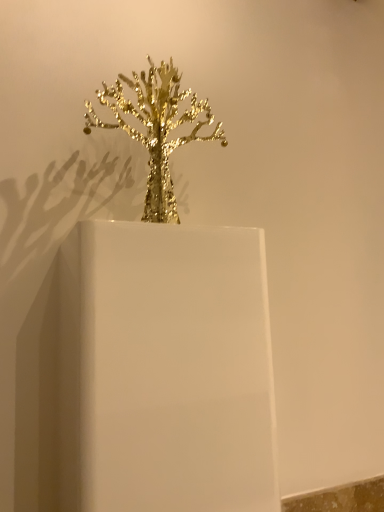
This screenshot has width=384, height=512. Describe the element at coordinates (155, 129) in the screenshot. I see `gold metallic tree at center` at that location.

Measure the distance between point (93, 126) and camera.

Point (93, 126) and camera are 1.11 meters apart.

Where is `gold metallic tree at center`? This screenshot has width=384, height=512. gold metallic tree at center is located at coordinates (155, 129).

The height and width of the screenshot is (512, 384). Describe the element at coordinates (165, 370) in the screenshot. I see `white glossy candle holder at center` at that location.

Locate an element on the screen. This screenshot has width=384, height=512. white glossy candle holder at center is located at coordinates (165, 370).

Where is `gold metallic tree at center`? Image resolution: width=384 pixels, height=512 pixels. gold metallic tree at center is located at coordinates (155, 129).

Which is more to the right, gold metallic tree at center or white glossy candle holder at center?

From the viewer's perspective, gold metallic tree at center appears more on the right side.

Is gold metallic tree at center closer to camera compared to white glossy candle holder at center?

No, gold metallic tree at center is further to the viewer.

Is point (168, 112) behind point (131, 368)?

Yes, it is behind point (131, 368).

From the image's perspective, is gold metallic tree at center under white glossy candle holder at center?

No.

From a real-world perspective, is gold metallic tree at center physically located above or below white glossy candle holder at center?

Clearly, from a real-world perspective, gold metallic tree at center is above white glossy candle holder at center.

Which of these two, gold metallic tree at center or white glossy candle holder at center, is wider?

white glossy candle holder at center.

Is gold metallic tree at center shorter than white glossy candle holder at center?

Yes, gold metallic tree at center is shorter than white glossy candle holder at center.

Is gold metallic tree at center bigger or smaller than white glossy candle holder at center?

gold metallic tree at center is smaller than white glossy candle holder at center.

Is white glossy candle holder at center inside gold metallic tree at center?

Actually, white glossy candle holder at center is outside gold metallic tree at center.

Is the surface of gold metallic tree at center in direct contact with white glossy candle holder at center?

No, gold metallic tree at center is not in contact with white glossy candle holder at center.

Is white glossy candle holder at center at the back of gold metallic tree at center?

No, gold metallic tree at center is not facing the opposite direction of white glossy candle holder at center.

How far apart are gold metallic tree at center and white glossy candle holder at center?

gold metallic tree at center is 13.17 inches away from white glossy candle holder at center.

I want to click on houseplant that is above the white glossy candle holder at center (from a real-world perspective), so click(155, 129).

Can you confirm if white glossy candle holder at center is positioned to the right of gold metallic tree at center?

No.

Is white glossy candle holder at center positioned behind gold metallic tree at center?

No, the depth of white glossy candle holder at center is less than that of gold metallic tree at center.

Is point (60, 484) behind point (122, 98)?

That is False.

From the image's perspective, which is above, white glossy candle holder at center or gold metallic tree at center?

From the image's view, gold metallic tree at center is above.

From a real-world perspective, which object rests below the other?

From a 3D spatial view, white glossy candle holder at center is below.

Can you confirm if white glossy candle holder at center is wider than gold metallic tree at center?

Indeed, white glossy candle holder at center has a greater width compared to gold metallic tree at center.

Who is shorter, white glossy candle holder at center or gold metallic tree at center?

Standing shorter between the two is gold metallic tree at center.

Which of these two, white glossy candle holder at center or gold metallic tree at center, is bigger?

With larger size is white glossy candle holder at center.

Do you think white glossy candle holder at center is within gold metallic tree at center, or outside of it?

white glossy candle holder at center is not enclosed by gold metallic tree at center.

Is white glossy candle holder at center not near gold metallic tree at center?

They are positioned close to each other.

Is white glossy candle holder at center aimed at gold metallic tree at center?

No, white glossy candle holder at center is not facing towards gold metallic tree at center.

Locate an element on the screen. The width and height of the screenshot is (384, 512). houseplant on the right of white glossy candle holder at center is located at coordinates (155, 129).

At what (x,y) coordinates should I click in order to perform the action: click on candle holder on the left of the gold metallic tree at center. Please return your answer as a coordinate pair (x, y). Looking at the image, I should click on (165, 370).

You are a GUI agent. You are given a task and a screenshot of the screen. Output one action in this format:
    pyautogui.click(x=<x>, y=<y>)
    Task: Click on the houseplant that appears on the right of white glossy candle holder at center
    This screenshot has width=384, height=512.
    Given the screenshot: What is the action you would take?
    (155, 129)